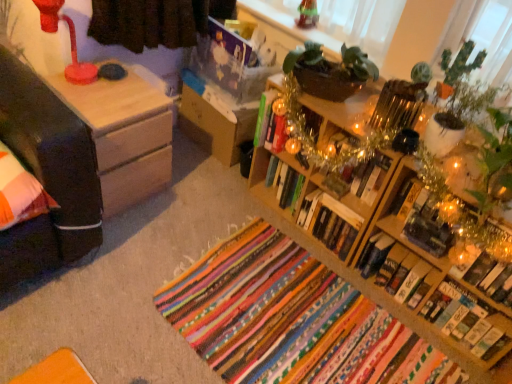
Image resolution: width=512 pixels, height=384 pixels. Find the location of `free spot to the left of multicolored woven rug at center`. free spot to the left of multicolored woven rug at center is located at coordinates (132, 286).